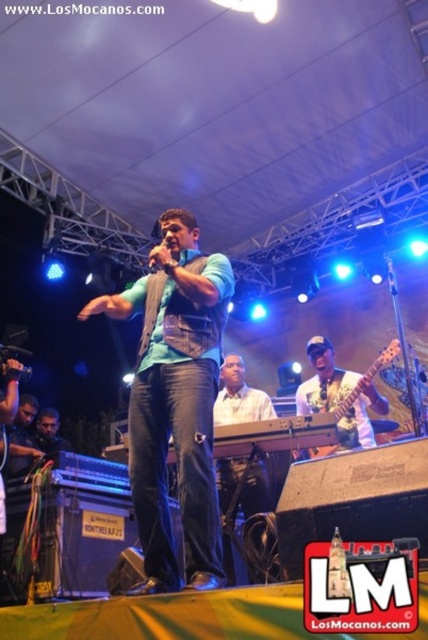
You are standing in the audience looking at the stage. There are two points marked on the stage. One is at coordinates point (205, 577) and the other at point (148, 262). Which point is closer to you?

Point (205, 577) is closer to the viewer than point (148, 262).

You are a photographer standing in the front row of the performance. You want to take a photo that includes both the matte green vest at center and the black matte microphone at center. Which object will appear larger in your photo?

The matte green vest at center will appear larger in the photo because it is closer to the viewer than the black matte microphone at center.